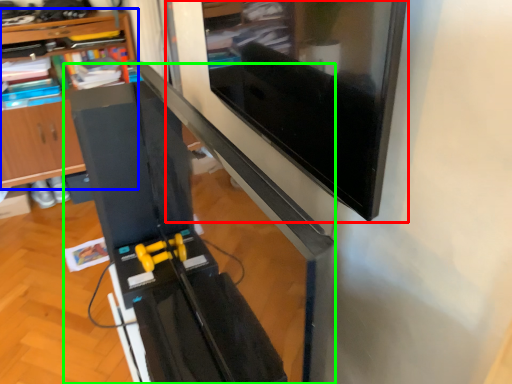
Question: Which is farther away from computer monitor (highlighted by a red box)? shelf (highlighted by a blue box) or computer desk (highlighted by a green box)?

Choices:
 (A) shelf
 (B) computer desk

Answer: (A)